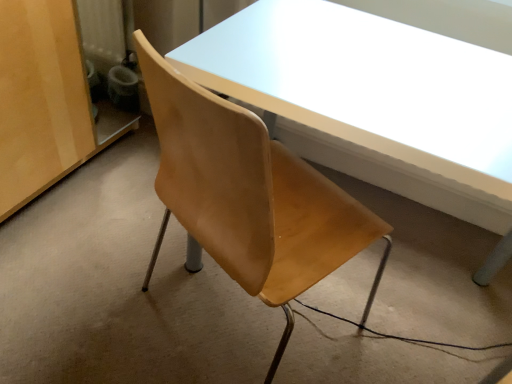
In order to click on wooden chair at center in this screenshot , I will do `click(120, 288)`.

In order to click on matte white table at center in this screenshot , I will do `click(376, 77)`.

Where is `concrete that is below the matte white table at center (from the image's perspective)`? This screenshot has height=384, width=512. concrete that is below the matte white table at center (from the image's perspective) is located at coordinates (120, 288).

From the image's perspective, which is above, wooden chair at center or matte white table at center?

From the image's view, matte white table at center is above.

Considering the relative sizes of wooden chair at center and matte white table at center in the image provided, is wooden chair at center taller than matte white table at center?

In fact, wooden chair at center may be shorter than matte white table at center.

Which of these two, wooden chair at center or matte white table at center, is bigger?

matte white table at center.

From the image's perspective, does matte wood cabinet at left appear lower than wooden chair at center?

No, from the image's perspective, matte wood cabinet at left is not beneath wooden chair at center.

Are matte wood cabinet at left and wooden chair at center located far from each other?

matte wood cabinet at left is near wooden chair at center, not far away.

Is matte wood cabinet at left surrounding wooden chair at center?

That's incorrect, wooden chair at center is not inside matte wood cabinet at left.

From the image's perspective, which one is positioned lower, matte wood cabinet at left or matte white table at center?

matte white table at center, from the image's perspective.

Which is behind, point (71, 66) or point (358, 127)?

Positioned behind is point (71, 66).

Is wooden chair at center at the right side of matte wood cabinet at left?

Correct, you'll find wooden chair at center to the right of matte wood cabinet at left.

From the image's perspective, does wooden chair at center appear lower than matte wood cabinet at left?

Indeed, from the image's perspective, wooden chair at center is shown beneath matte wood cabinet at left.

Would you say matte white table at center is outside wooden chair at center?

Yes, matte white table at center is located beyond the bounds of wooden chair at center.

Is matte white table at center aimed at wooden chair at center?

No, matte white table at center is not oriented towards wooden chair at center.

Is matte white table at center to the left or to the right of wooden chair at center in the image?

In the image, matte white table at center appears on the right side of wooden chair at center.

Image resolution: width=512 pixels, height=384 pixels. In order to click on table above the wooden chair at center (from a real-world perspective) in this screenshot , I will do `click(376, 77)`.

Is matte white table at center positioned in front of matte wood cabinet at left?

That is True.

The height and width of the screenshot is (384, 512). Identify the location of table below the matte wood cabinet at left (from the image's perspective). (376, 77).

In the scene shown: Is matte wood cabinet at left located within matte white table at center?

No, matte wood cabinet at left is located outside of matte white table at center.

Locate an element on the screen. concrete below the matte white table at center (from a real-world perspective) is located at coordinates (120, 288).

You are a GUI agent. You are given a task and a screenshot of the screen. Output one action in this format:
    pyautogui.click(x=<x>, y=<y>)
    Task: Click on the plywood located above the wooden chair at center (from the image's perspective)
    
    Given the screenshot: What is the action you would take?
    [40, 99]

Which object lies nearer to the anchor point matte wood cabinet at left, matte white table at center or wooden chair at center?

wooden chair at center lies closer to matte wood cabinet at left than the other object.

Based on their spatial positions, is matte white table at center or matte wood cabinet at left closer to wooden chair at center?

The object closer to wooden chair at center is matte wood cabinet at left.

Considering their positions, is wooden chair at center positioned further to matte wood cabinet at left than matte white table at center?

matte white table at center.

Which object lies nearer to the anchor point matte white table at center, matte wood cabinet at left or wooden chair at center?

Among the two, wooden chair at center is located nearer to matte white table at center.

Based on their spatial positions, is matte wood cabinet at left or matte white table at center closer to wooden chair at center?

matte wood cabinet at left lies closer to wooden chair at center than the other object.

Considering their positions, is wooden chair at center positioned further to matte white table at center than matte wood cabinet at left?

matte wood cabinet at left is further to matte white table at center.

Where is `concrete between matte wood cabinet at left and matte white table at center from left to right`? The width and height of the screenshot is (512, 384). concrete between matte wood cabinet at left and matte white table at center from left to right is located at coordinates (120, 288).